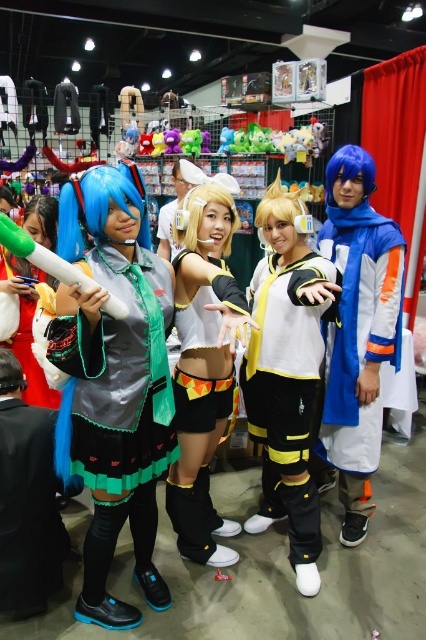
You are a photographer at the convention and need to capture a photo of the white satin skirt at center and the plush purple bear at center. Which object should you focus on first if you want to ensure both are in frame without moving the camera?

You should focus on the white satin skirt at center first because it is larger in size than the plush purple bear at center, making it easier to center the camera frame around it to include both objects.

You are organizing a photo shoot and need to position the blue fabric jacket at right and the plush purple bear at center so that they are both visible in the frame. Based on their sizes, which object should be placed closer to the camera to ensure both fit well in the shot?

The blue fabric jacket at right might be wider than the plush purple bear at center, so placing the jacket closer to the camera would help ensure both fit well in the frame since wider objects need to be nearer to maintain visibility without overcrowding the shot.